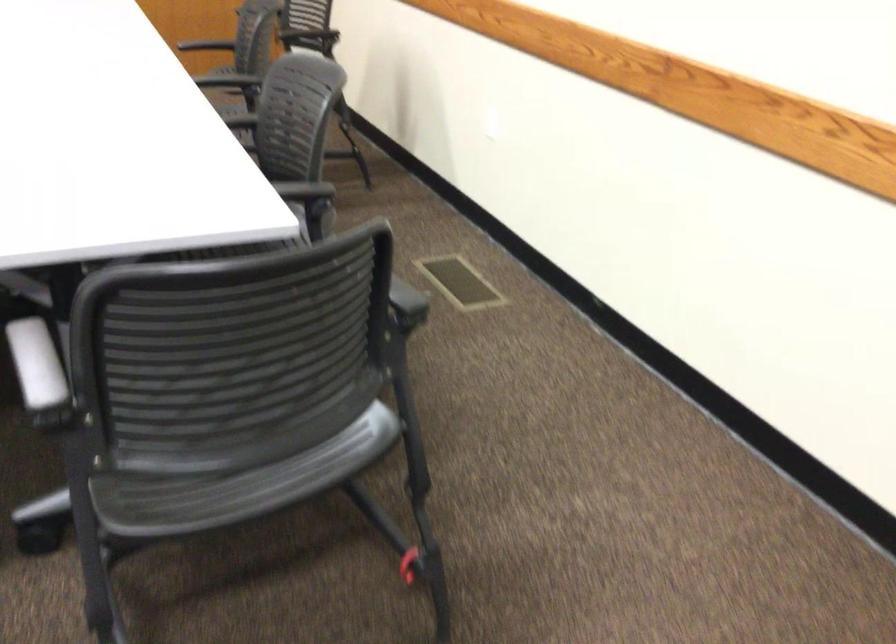
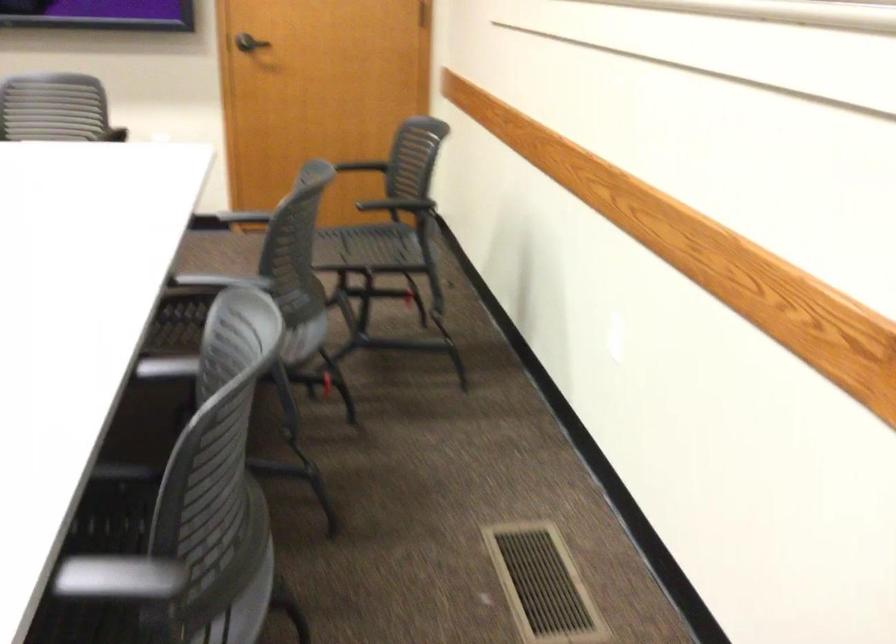
Question: The images are taken continuously from a first-person perspective. In which direction is your viewpoint rotating?

Choices:
 (A) Left
 (B) Right
 (C) Up
 (D) Down

Answer: (A)